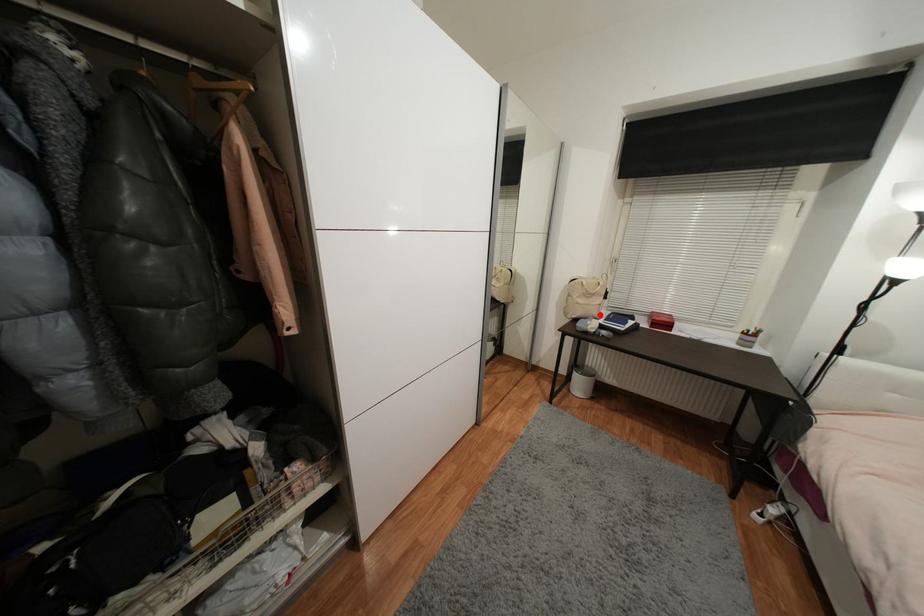
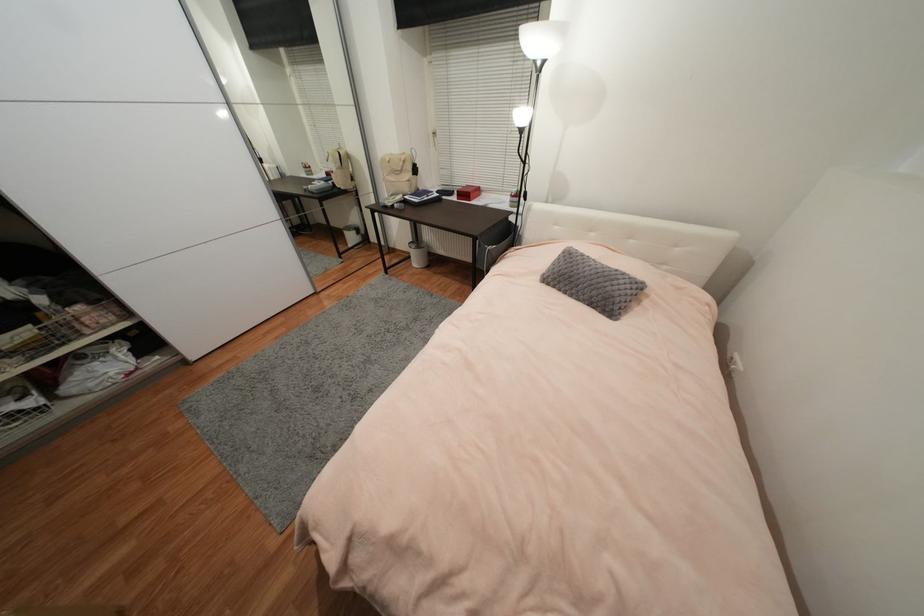
The point at the highlighted location is marked in the first image. Where is the corresponding point in the second image?

(410, 191)